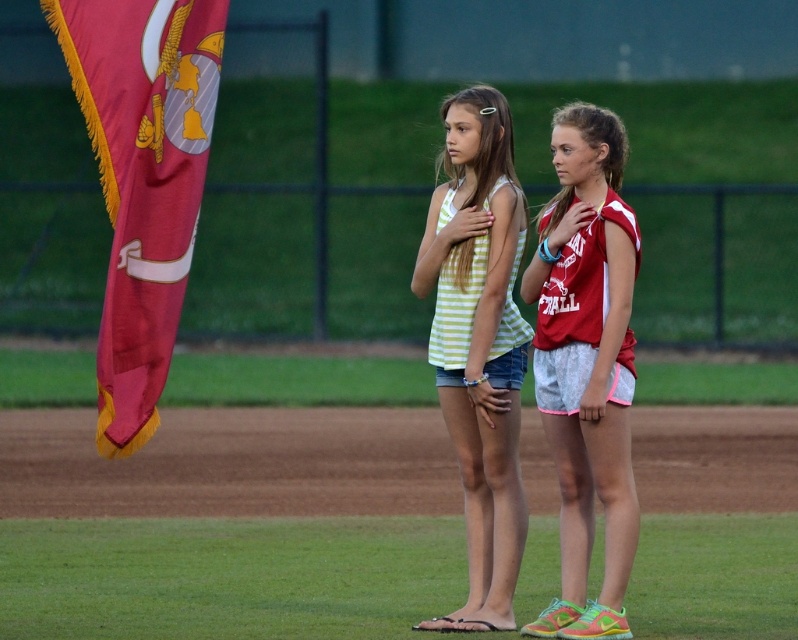
You are a photographer at the flag ceremony. You want to capture a photo where the red fabric flag at left and the striped fabric tank top at center are both clearly visible. Based on their sizes, which object might appear larger in the photo?

The red fabric flag at left might be wider than the striped fabric tank top at center, so it could appear larger in the photo.

You are a photographer at a flag ceremony. You need to capture both the red fabric flag at left and the red jersey shorts at center in the same frame. Which object should you focus on first to ensure both are visible?

The red fabric flag at left occupies less space than the red jersey shorts at center, so you should focus on the red jersey shorts at center first to ensure both fit in the frame.